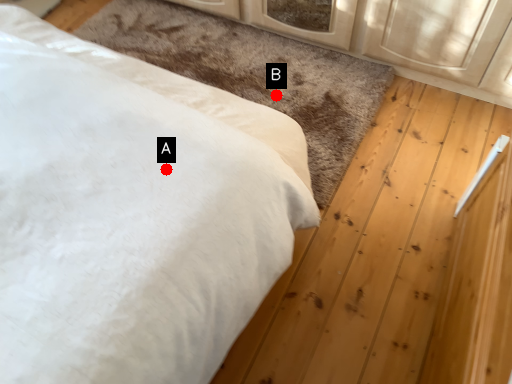
Question: Two points are circled on the image, labeled by A and B beside each circle. Which point is closer to the camera?

Choices:
 (A) A is closer
 (B) B is closer

Answer: (A)